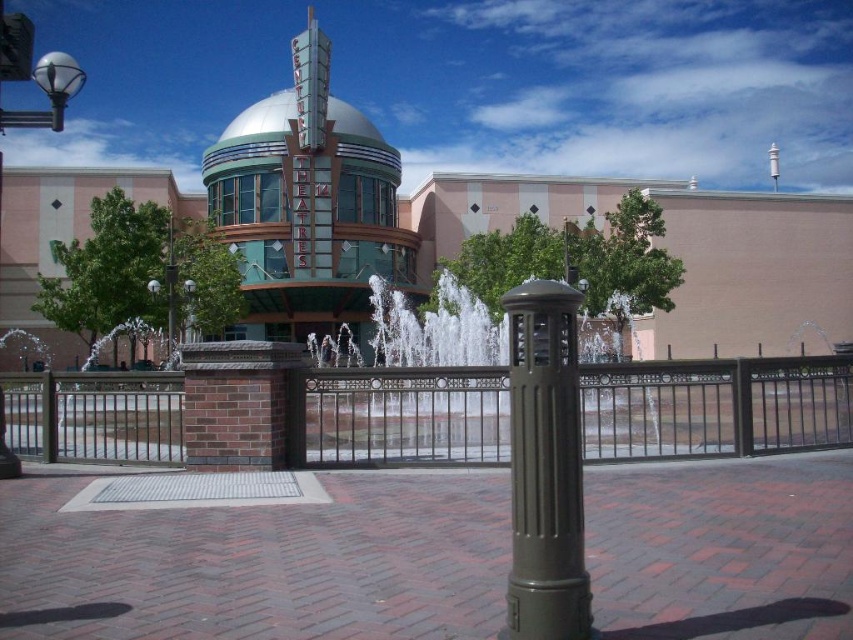
Question: Where is green glass dome at center located in relation to polished silver lamp post at left in the image?

Choices:
 (A) above
 (B) below

Answer: (A)

Question: Does metallic silver streetlight at upper left have a larger size compared to polished silver lamp post at left?

Choices:
 (A) yes
 (B) no

Answer: (A)

Question: Is brown metal fence at center further to the viewer compared to polished silver lamp post at left?

Choices:
 (A) yes
 (B) no

Answer: (B)

Question: Which point appears farthest from the camera in this image?

Choices:
 (A) coord(3,124)
 (B) coord(534,518)

Answer: (A)

Question: Which of these objects is positioned farthest from the green matte pole at center?

Choices:
 (A) brown metal fence at center
 (B) metallic silver streetlight at upper left
 (C) green glass dome at center
 (D) polished silver lamp post at left

Answer: (C)

Question: Which of the following is the farthest from the observer?

Choices:
 (A) 540,452
 (B) 339,465

Answer: (B)